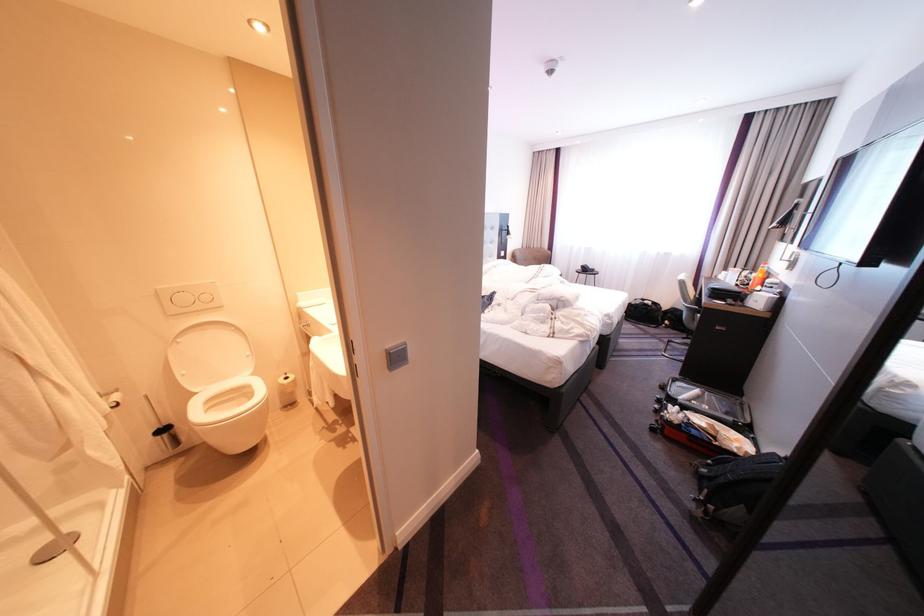
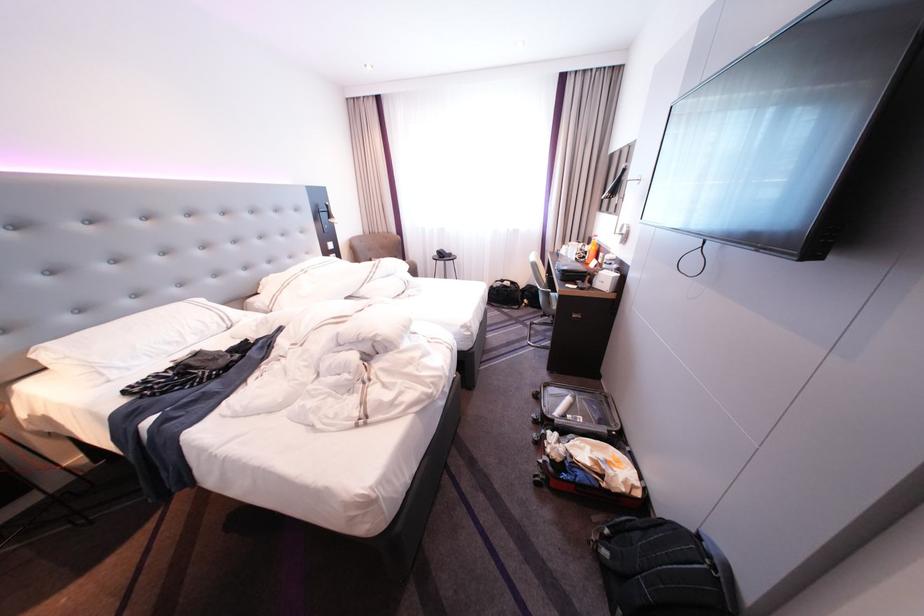
The point at (553,270) is marked in the first image. Where is the corresponding point in the second image?

(390, 267)